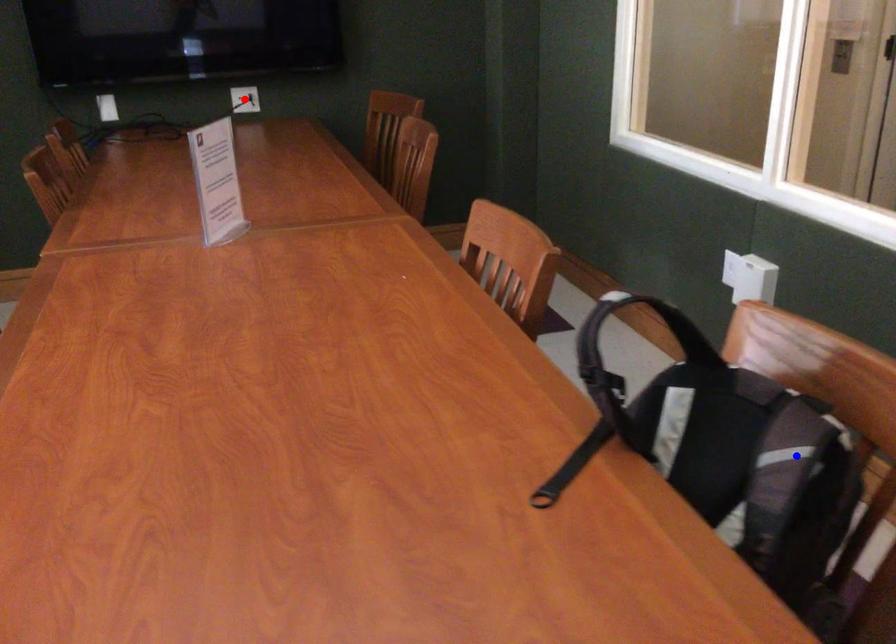
Question: In the image, two points are highlighted. Which point is nearer to the camera? Reply with the corresponding letter.

Choices:
 (A) blue point
 (B) red point

Answer: (A)